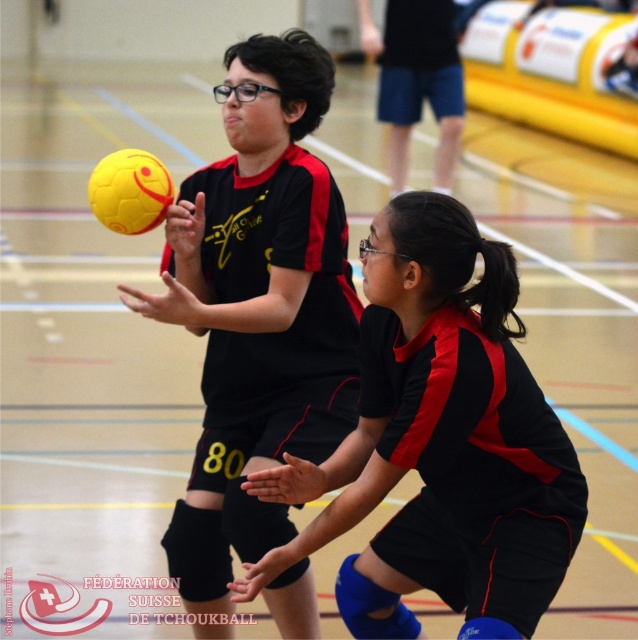
Does black matte uniform at center lie in front of yellow matte volleyball at center?

Yes, black matte uniform at center is in front of yellow matte volleyball at center.

Who is more distant from viewer, [521,356] or [121,221]?

The point [121,221] is more distant.

Between point (505, 492) and point (130, 220), which one is positioned behind?

The point (130, 220) is behind.

Locate an element on the screen. The height and width of the screenshot is (640, 638). black matte uniform at center is located at coordinates (440, 440).

Is black matte uniform at center above yellow matte ball at upper left?

Actually, black matte uniform at center is below yellow matte ball at upper left.

Who is taller, black matte uniform at center or yellow matte ball at upper left?

Standing taller between the two is yellow matte ball at upper left.

Locate an element on the screen. black matte uniform at center is located at coordinates (440, 440).

Which is in front, point (286, 598) or point (122, 202)?

Positioned in front is point (122, 202).

What do you see at coordinates (256, 310) in the screenshot? I see `yellow matte ball at upper left` at bounding box center [256, 310].

You are a GUI agent. You are given a task and a screenshot of the screen. Output one action in this format:
    pyautogui.click(x=<x>, y=<y>)
    Task: Click on the yellow matte ball at upper left
    This screenshot has width=638, height=640.
    Given the screenshot: What is the action you would take?
    pyautogui.click(x=256, y=310)